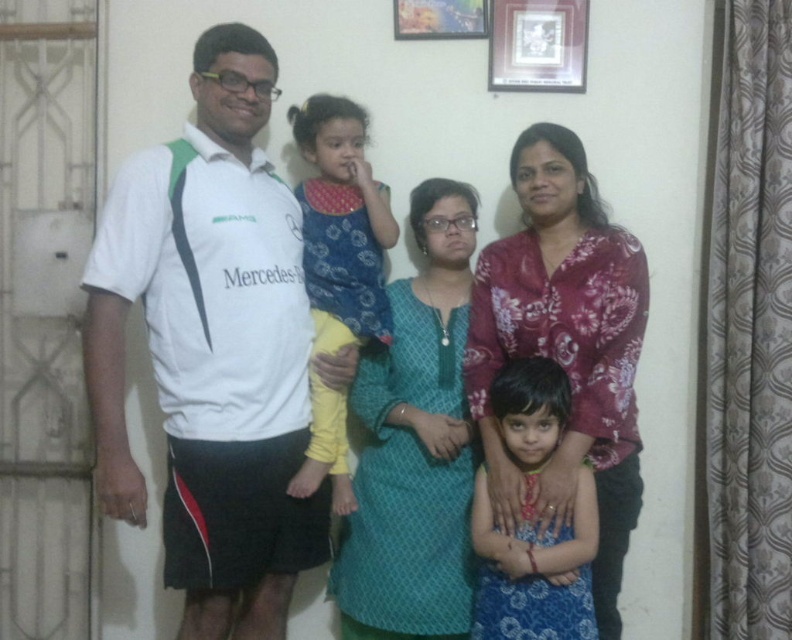
Question: Among these points, which one is nearest to the camera?

Choices:
 (A) (341, 305)
 (B) (592, 384)
 (C) (495, 568)
 (D) (455, 0)

Answer: (C)

Question: Estimate the real-world distances between objects in this image. Which object is farther from the metallic silver picture frame at upper center?

Choices:
 (A) wooden frame at upper center
 (B) blue floral dress at center
 (C) teal cotton kurta at center
 (D) floral silk blouse at center

Answer: (B)

Question: In this image, where is white cotton shirt at left located relative to blue floral dress at center?

Choices:
 (A) below
 (B) above

Answer: (B)

Question: Does white jersey at left come behind teal cotton kurta at center?

Choices:
 (A) no
 (B) yes

Answer: (A)

Question: Does white cotton shirt at left have a greater width compared to blue floral dress at center?

Choices:
 (A) no
 (B) yes

Answer: (B)

Question: Which point is farther to the camera?

Choices:
 (A) blue floral dress at center
 (B) white cotton shirt at left

Answer: (B)